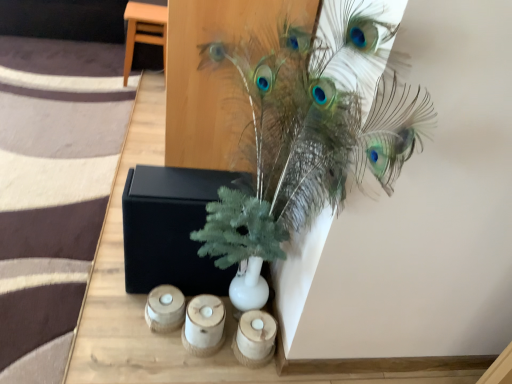
This screenshot has width=512, height=384. In order to click on vacant space situated on the left part of wooden candle holder at lower center, positioned as the first candle holder in left-to-right order in this screenshot , I will do `click(110, 308)`.